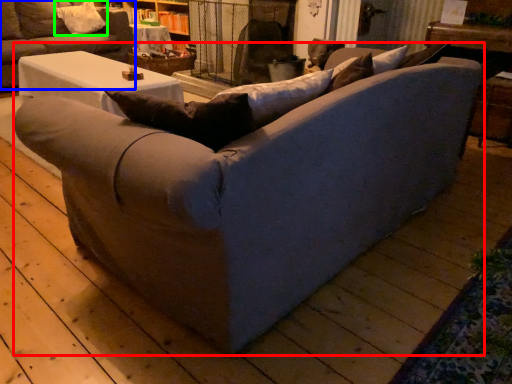
Question: Which object is positioned closest to studio couch (highlighted by a red box)? Select from studio couch (highlighted by a blue box) and pillow (highlighted by a green box).

Choices:
 (A) studio couch
 (B) pillow

Answer: (A)